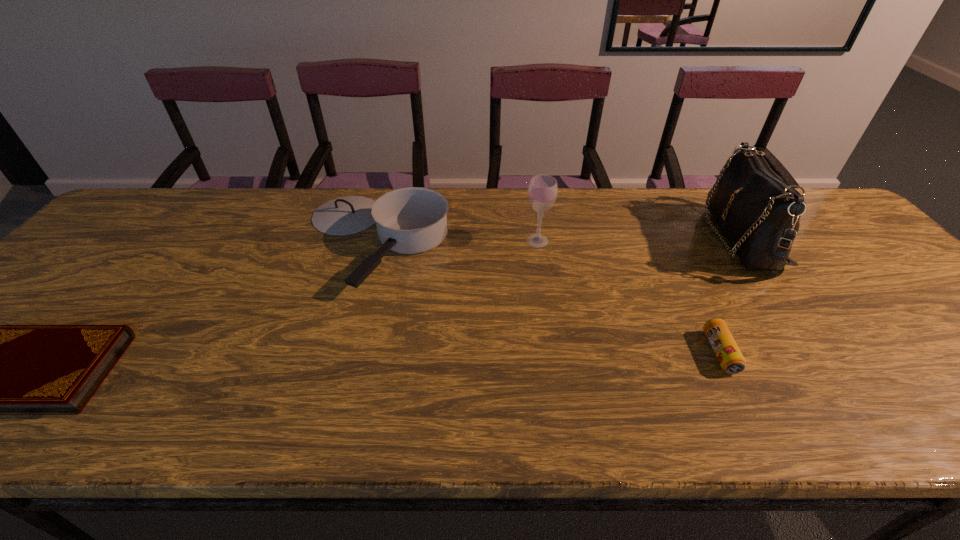
You are a GUI agent. You are given a task and a screenshot of the screen. Output one action in this format:
    pyautogui.click(x=<x>, y=<y>)
    Task: Click on the tallest object
    This screenshot has width=960, height=540.
    Given the screenshot: What is the action you would take?
    pyautogui.click(x=759, y=213)

Find the location of a particular element. Image resolution: width=960 pixels, height=540 pixels. handbag is located at coordinates (759, 213).

The height and width of the screenshot is (540, 960). Find the location of `the fourth shortest object`. the fourth shortest object is located at coordinates (542, 192).

You are a GUI agent. You are given a task and a screenshot of the screen. Output one action in this format:
    pyautogui.click(x=<x>, y=<y>)
    Task: Click on the third object from left to right
    
    Given the screenshot: What is the action you would take?
    pyautogui.click(x=542, y=192)

Image resolution: width=960 pixels, height=540 pixels. What are the coordinates of `saucepan` in the screenshot? It's located at (412, 220).

The width and height of the screenshot is (960, 540). What are the coordinates of `the fourth object from right to left` in the screenshot? It's located at (412, 220).

Locate an element on the screen. The image size is (960, 540). the fourth tallest object is located at coordinates 730,358.

Find the location of `beer can`. beer can is located at coordinates (730, 358).

You are a GUI agent. You are given a task and a screenshot of the screen. Output one action in this format:
    pyautogui.click(x=<x>, y=<y>)
    Task: Click on the vacant space situated at the front of the handbag with chain and zipper
    Image resolution: width=960 pixels, height=540 pixels.
    Given the screenshot: What is the action you would take?
    pyautogui.click(x=665, y=238)

At what (x,y) coordinates should I click in order to perform the action: click on vacant space positioned 0.140m at the front of the handbag with chain and zipper. Please return your answer as a coordinate pair (x, y). This screenshot has height=540, width=960. Looking at the image, I should click on (661, 238).